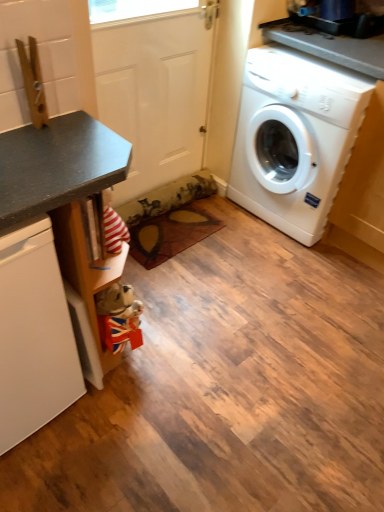
Question: Is white matte door at center in front of or behind white matte dishwasher at left in the image?

Choices:
 (A) front
 (B) behind

Answer: (B)

Question: Is white matte door at center taller or shorter than white matte dishwasher at left?

Choices:
 (A) tall
 (B) short

Answer: (A)

Question: Which object is the closest to the white plastic washing machine at right?

Choices:
 (A) matte black counter at left
 (B) white matte dishwasher at left
 (C) white matte door at center

Answer: (C)

Question: Which object is the farthest from the matte black counter at left?

Choices:
 (A) white plastic washing machine at right
 (B) white matte door at center
 (C) white matte dishwasher at left

Answer: (A)